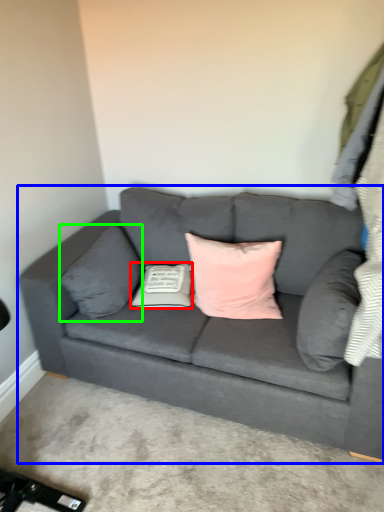
Question: Estimate the real-world distances between objects in this image. Which object is farther from pillow (highlighted by a red box), studio couch (highlighted by a blue box) or pillow (highlighted by a green box)?

Choices:
 (A) studio couch
 (B) pillow

Answer: (A)